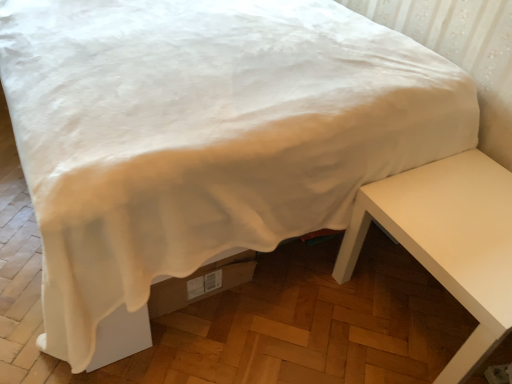
Question: Should I look upward or downward to see white glossy table at right?

Choices:
 (A) down
 (B) up

Answer: (A)